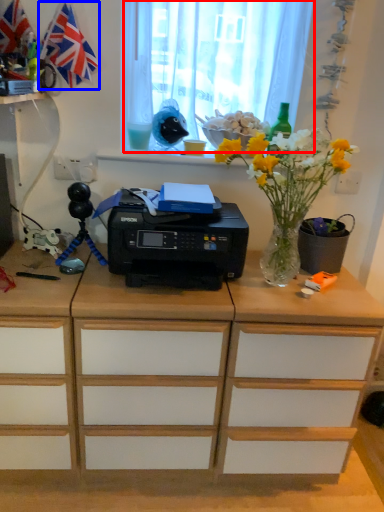
Question: Which point is closer to the camera, curtain (highlighted by a red box) or flag (highlighted by a blue box)?

Choices:
 (A) curtain
 (B) flag

Answer: (B)